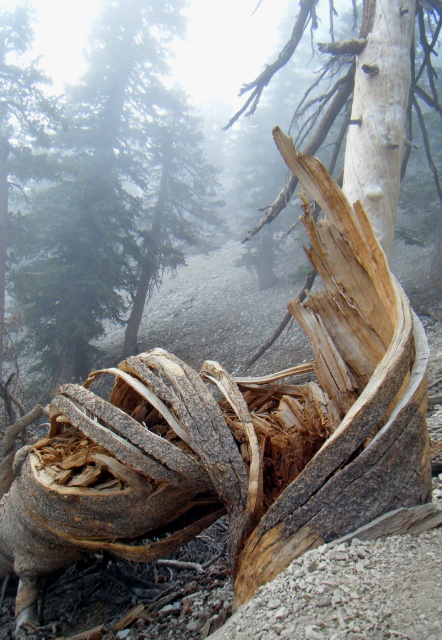
Question: Which point is closer to the camera taking this photo?

Choices:
 (A) (395, 200)
 (B) (29, 220)
 (C) (351, 122)

Answer: (A)

Question: Does rough bark tree trunk at center have a smaller size compared to white textured bark at center?

Choices:
 (A) yes
 (B) no

Answer: (B)

Question: Which of the following is the closest to the observer?

Choices:
 (A) white textured bark at center
 (B) rough bark tree trunk at center

Answer: (A)

Question: Which object is closer to the camera taking this photo?

Choices:
 (A) white textured bark at upper right
 (B) white textured bark at center
 (C) rough bark tree trunk at center

Answer: (A)

Question: Is rough bark tree trunk at center to the left of white textured bark at center from the viewer's perspective?

Choices:
 (A) yes
 (B) no

Answer: (A)

Question: Is rough bark tree trunk at center smaller than white textured bark at upper right?

Choices:
 (A) yes
 (B) no

Answer: (B)